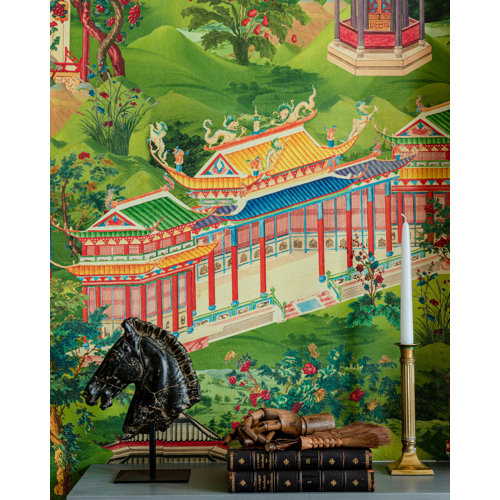
Where is `front right corner of candle base`? This screenshot has width=500, height=500. front right corner of candle base is located at coordinates (433, 470).